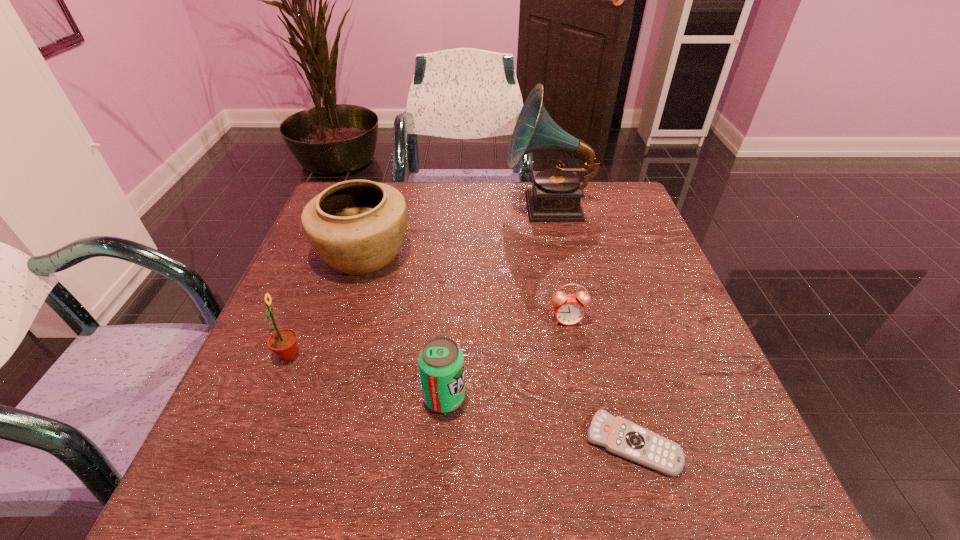
Locate an element on the screen. This screenshot has width=960, height=540. empty space that is in between the sunflower and the pottery is located at coordinates (326, 305).

Locate an element on the screen. object that stands as the third closest to the fourth tallest object is located at coordinates (283, 343).

Locate which object is the fifth closest to the third farthest object. Please provide its 2D coordinates. Your answer should be formatted as a tuple, i.e. [(x, y)], where the tuple contains the x and y coordinates of a point satisfying the conditions above.

[(283, 343)]

You are a GUI agent. You are given a task and a screenshot of the screen. Output one action in this format:
    pyautogui.click(x=<x>, y=<y>)
    Task: Click on the vacant area in the image that satisfies the following two spatial constraints: 1. on the front-facing side of the remote control; 2. on the right side of the third object from left to right
    This screenshot has width=960, height=540.
    Given the screenshot: What is the action you would take?
    pyautogui.click(x=442, y=444)

The image size is (960, 540). I want to click on vacant space that satisfies the following two spatial constraints: 1. on the clock face of the fifth tallest object; 2. on the left side of the remote control, so click(x=591, y=444).

Locate an element on the screen. Image resolution: width=960 pixels, height=540 pixels. free space in the image that satisfies the following two spatial constraints: 1. from the horn of the phonograph_record; 2. on the clock face of the third farthest object is located at coordinates point(572,320).

The height and width of the screenshot is (540, 960). I want to click on vacant space that satisfies the following two spatial constraints: 1. on the face of the fourth farthest object; 2. on the right side of the remote control, so click(x=252, y=444).

Identify the location of free space that satisfies the following two spatial constraints: 1. on the clock face of the fourth nearest object; 2. on the front-facing side of the third object from left to right. The height and width of the screenshot is (540, 960). (583, 397).

Image resolution: width=960 pixels, height=540 pixels. Identify the location of vacant space that satisfies the following two spatial constraints: 1. on the clock face of the alarm clock; 2. on the left side of the shortest object. (591, 444).

The height and width of the screenshot is (540, 960). Identify the location of free space that satisfies the following two spatial constraints: 1. on the face of the remote control; 2. on the left side of the sunflower. tap(252, 444).